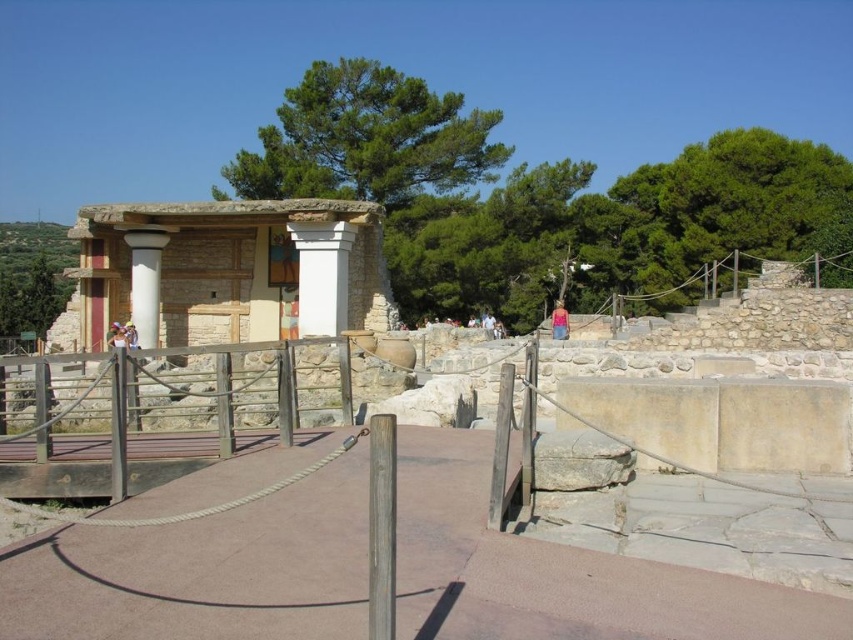
Does point (300, 256) come closer to viewer compared to point (154, 321)?

Yes, point (300, 256) is closer to viewer.

What do you see at coordinates (322, 275) in the screenshot?
I see `white stone column at center` at bounding box center [322, 275].

Who is more forward, (332, 280) or (151, 308)?

Point (332, 280) is in front.

Where is `white stone column at center`? white stone column at center is located at coordinates (322, 275).

How far apart are brown concrete path at center and blue denim shorts at center?

The distance of brown concrete path at center from blue denim shorts at center is 34.75 meters.

Find the location of `brown concrete path at center`. brown concrete path at center is located at coordinates (204, 572).

Does white stone amphitheater at center come behind white stone column at center?

That is False.

Which is more to the left, white stone amphitheater at center or white stone column at center?

white stone amphitheater at center is more to the left.

Looking at this image, measure the distance between point (300,314) and camera.

26.62 meters

Locate an element on the screen. This screenshot has height=640, width=853. white stone amphitheater at center is located at coordinates (227, 272).